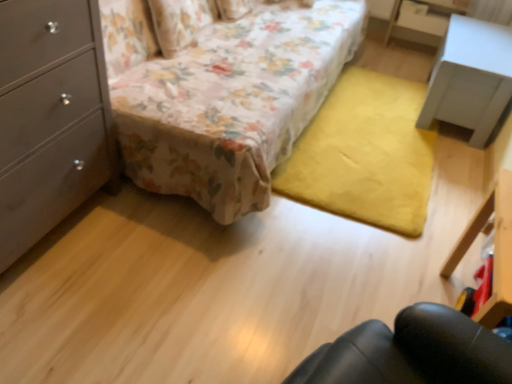
Question: Is floral fabric couch at center to the left of matte gray dresser at left from the viewer's perspective?

Choices:
 (A) no
 (B) yes

Answer: (A)

Question: Considering the relative positions of floral fabric couch at center and matte gray dresser at left in the image provided, is floral fabric couch at center to the right of matte gray dresser at left from the viewer's perspective?

Choices:
 (A) yes
 (B) no

Answer: (A)

Question: Is floral fabric couch at center closer to the viewer compared to matte gray dresser at left?

Choices:
 (A) yes
 (B) no

Answer: (B)

Question: Is floral fabric couch at center not inside matte gray dresser at left?

Choices:
 (A) yes
 (B) no

Answer: (A)

Question: Considering the relative sizes of floral fabric couch at center and matte gray dresser at left in the image provided, is floral fabric couch at center wider than matte gray dresser at left?

Choices:
 (A) yes
 (B) no

Answer: (A)

Question: Relative to matte gray dresser at left, is white matte nightstand at upper right in front or behind?

Choices:
 (A) behind
 (B) front

Answer: (A)

Question: In terms of size, does white matte nightstand at upper right appear bigger or smaller than matte gray dresser at left?

Choices:
 (A) big
 (B) small

Answer: (B)

Question: Looking at their shapes, would you say white matte nightstand at upper right is wider or thinner than matte gray dresser at left?

Choices:
 (A) thin
 (B) wide

Answer: (A)

Question: Considering the positions of white matte nightstand at upper right and matte gray dresser at left in the image, is white matte nightstand at upper right taller or shorter than matte gray dresser at left?

Choices:
 (A) short
 (B) tall

Answer: (A)

Question: In the image, is black plastic vanity at lower right positioned in front of or behind white matte nightstand at upper right?

Choices:
 (A) front
 (B) behind

Answer: (A)

Question: From a real-world perspective, is black plastic vanity at lower right physically located above or below white matte nightstand at upper right?

Choices:
 (A) below
 (B) above

Answer: (B)

Question: Would you say black plastic vanity at lower right is to the left or to the right of white matte nightstand at upper right in the picture?

Choices:
 (A) left
 (B) right

Answer: (A)

Question: From their relative heights in the image, would you say black plastic vanity at lower right is taller or shorter than white matte nightstand at upper right?

Choices:
 (A) short
 (B) tall

Answer: (B)

Question: In terms of size, does white matte nightstand at upper right appear bigger or smaller than black plastic vanity at lower right?

Choices:
 (A) big
 (B) small

Answer: (A)

Question: From a real-world perspective, relative to black plastic vanity at lower right, is white matte nightstand at upper right vertically above or below?

Choices:
 (A) above
 (B) below

Answer: (B)